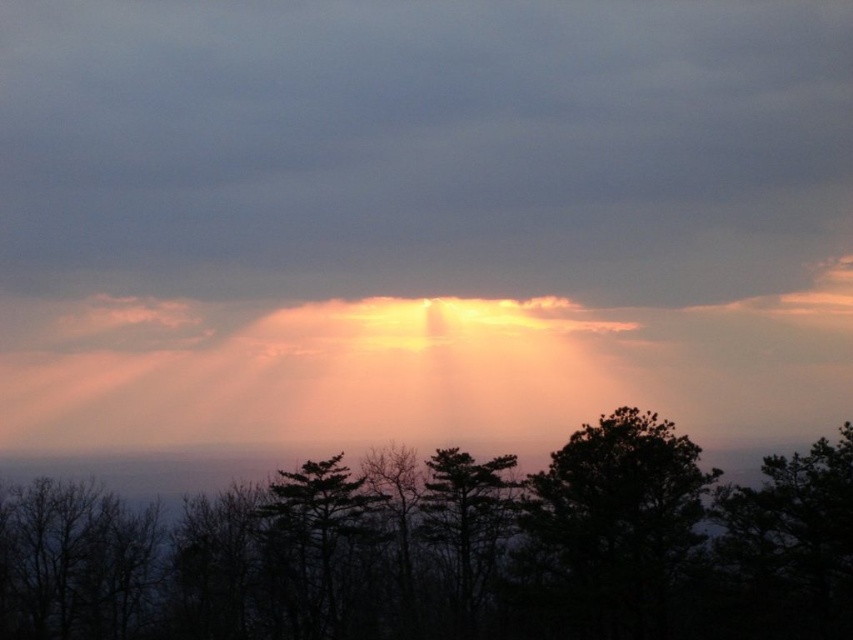
Question: Which of the following is the farthest from the observer?

Choices:
 (A) silhouette tree at center
 (B) dark green textured tree at center

Answer: (B)

Question: Which object is closer to the camera taking this photo?

Choices:
 (A) green matte tree at center
 (B) dark green textured tree at center
 (C) silhouette tree at center

Answer: (C)

Question: Can you confirm if silhouette tree at center is wider than dark green textured tree at center?

Choices:
 (A) no
 (B) yes

Answer: (B)

Question: Which object appears farthest from the camera in this image?

Choices:
 (A) dark green textured tree at center
 (B) green matte tree at center

Answer: (B)

Question: Is dark green textured tree at center positioned in front of green matte tree at center?

Choices:
 (A) no
 (B) yes

Answer: (B)

Question: Is silhouette tree at center further to the viewer compared to dark green textured tree at center?

Choices:
 (A) yes
 (B) no

Answer: (B)